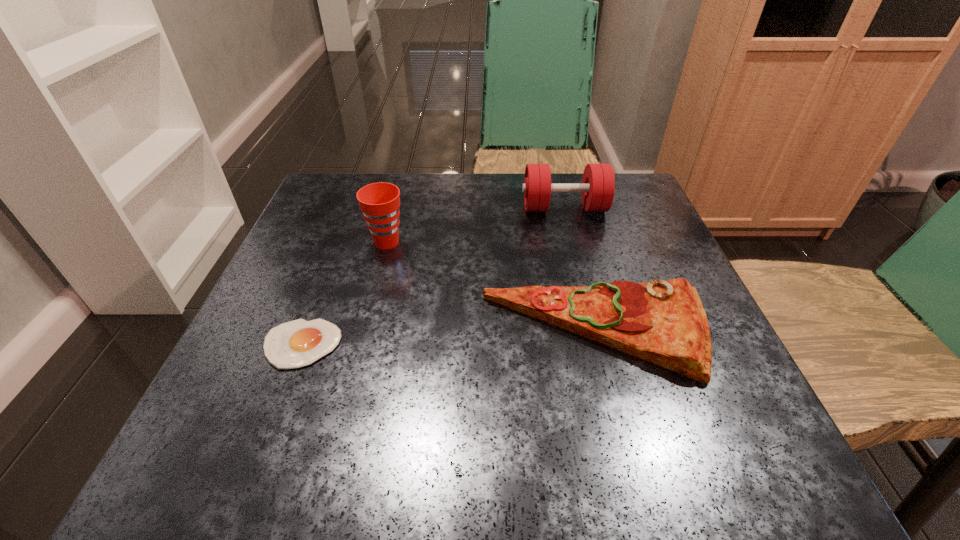
Find the location of a particular element. This screenshot has width=960, height=540. cup at the left edge is located at coordinates (379, 202).

This screenshot has width=960, height=540. I want to click on egg yolk located at the left edge, so click(298, 343).

This screenshot has height=540, width=960. In order to click on dumbbell at the right edge in this screenshot , I will do `click(598, 183)`.

Find the location of a particular element. pizza that is positioned at the right edge is located at coordinates (663, 322).

The image size is (960, 540). Find the location of `object located at the far left corner`. object located at the far left corner is located at coordinates (379, 202).

Locate an element on the screen. object located at the far right corner is located at coordinates (598, 183).

Find the location of a particular element. Image resolution: width=960 pixels, height=540 pixels. free space at the far edge of the desktop is located at coordinates (400, 221).

This screenshot has height=540, width=960. Find the location of `vacant space at the near edge of the desktop`. vacant space at the near edge of the desktop is located at coordinates point(323,434).

What are the coordinates of `blank space at the left edge` in the screenshot? It's located at (249, 404).

Identify the location of vacant position at the right edge of the desktop. The image size is (960, 540). (601, 253).